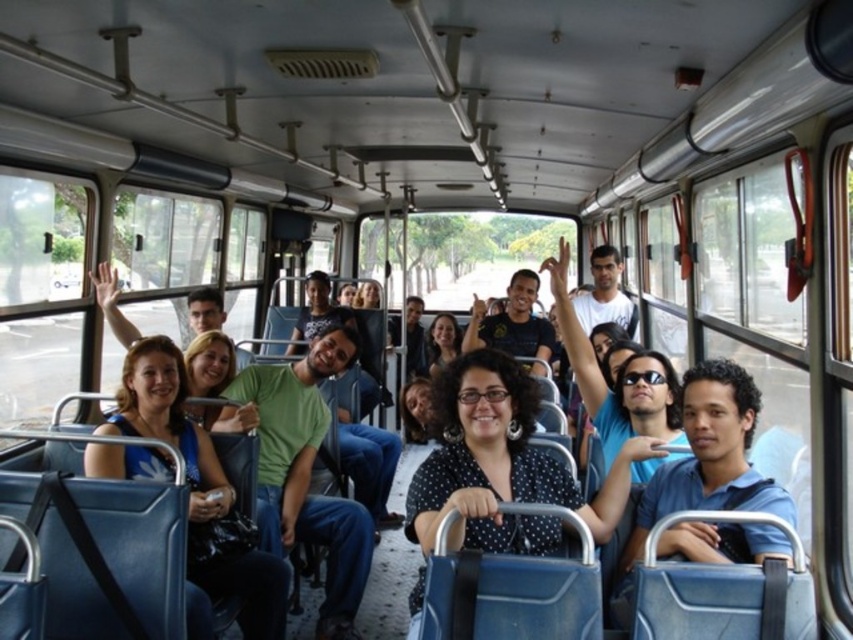
The height and width of the screenshot is (640, 853). What do you see at coordinates (503, 465) in the screenshot? I see `black dotted blouse at center` at bounding box center [503, 465].

Does black dotted blouse at center have a lesser height compared to green matte shirt at center?

Correct, black dotted blouse at center is not as tall as green matte shirt at center.

This screenshot has height=640, width=853. What do you see at coordinates (503, 465) in the screenshot? I see `black dotted blouse at center` at bounding box center [503, 465].

Locate an element on the screen. The image size is (853, 640). black dotted blouse at center is located at coordinates (503, 465).

You are a GUI agent. You are given a task and a screenshot of the screen. Output one action in this format:
    pyautogui.click(x=<x>, y=<y>)
    Task: Click on the black dotted blouse at center
    The image size is (853, 640).
    Given the screenshot: What is the action you would take?
    pyautogui.click(x=503, y=465)

Between black dotted blouse at center and blue cotton shirt at center, which one appears on the right side from the viewer's perspective?

From the viewer's perspective, blue cotton shirt at center appears more on the right side.

This screenshot has width=853, height=640. In order to click on black dotted blouse at center in this screenshot , I will do `click(503, 465)`.

Locate an element on the screen. black dotted blouse at center is located at coordinates point(503,465).

Who is more forward, (515, 388) or (149, 420)?

Point (515, 388) is in front.

Does black dotted blouse at center appear under matte blue shirt at center?

Incorrect, black dotted blouse at center is not positioned below matte blue shirt at center.

Is point (497, 540) behind point (136, 420)?

No, (497, 540) is closer to viewer.

Locate an element on the screen. The width and height of the screenshot is (853, 640). black dotted blouse at center is located at coordinates (503, 465).